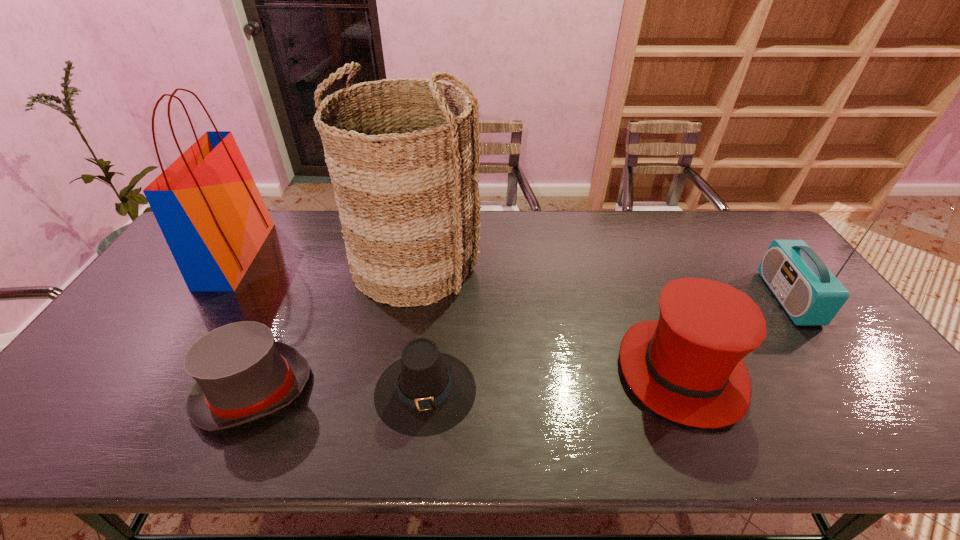
This screenshot has height=540, width=960. Find the location of `vacant space at the far edge`. vacant space at the far edge is located at coordinates (328, 248).

This screenshot has width=960, height=540. Identify the location of blank space at the near edge. (558, 435).

In the image, there is a desktop. In order to click on vacant space at the left edge in this screenshot , I will do `click(75, 411)`.

In the image, there is a desktop. Where is `blank space at the right edge`? This screenshot has width=960, height=540. blank space at the right edge is located at coordinates (798, 344).

This screenshot has height=540, width=960. I want to click on free space at the far right corner, so click(745, 222).

Where is `vacant area that lies between the second hat from right to left and the basket`? vacant area that lies between the second hat from right to left and the basket is located at coordinates (420, 327).

You are a GUI agent. You are given a task and a screenshot of the screen. Output one action in this format:
    pyautogui.click(x=<x>, y=<y>)
    Task: Click on the vacant area between the second hat from left to right and the basket
    The width and height of the screenshot is (960, 540).
    Given the screenshot: What is the action you would take?
    pyautogui.click(x=420, y=327)

Find the location of `vacant area between the basket and the rightmost hat`. vacant area between the basket and the rightmost hat is located at coordinates (548, 318).

Locate an element on the screen. This screenshot has width=960, height=540. free space between the leftmost hat and the rightmost object is located at coordinates (520, 344).

Where is `free space between the leftmost object and the second hat from right to left`? This screenshot has width=960, height=540. free space between the leftmost object and the second hat from right to left is located at coordinates (330, 322).